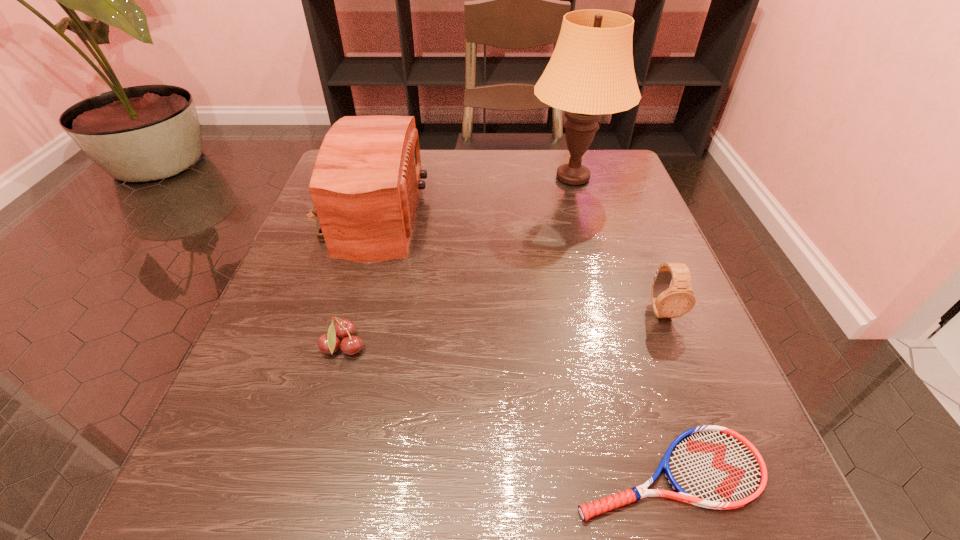
Find the location of a particular element. tennis racket that is at the right edge is located at coordinates (714, 467).

This screenshot has width=960, height=540. I want to click on object located at the far left corner, so tap(365, 183).

At what (x,y) coordinates should I click in order to perform the action: click on object that is at the far right corner. Please return your answer as a coordinate pair (x, y). This screenshot has height=540, width=960. Looking at the image, I should click on (591, 72).

This screenshot has width=960, height=540. I want to click on object that is positioned at the near right corner, so click(x=714, y=467).

Locate an element on the screen. Image resolution: width=960 pixels, height=540 pixels. vacant space at the far edge of the desktop is located at coordinates (561, 200).

Where is `free space at the near edge of the desktop`? free space at the near edge of the desktop is located at coordinates (427, 465).

In the image, there is a desktop. Where is `vacant space at the left edge`? This screenshot has height=540, width=960. vacant space at the left edge is located at coordinates point(324,295).

Find the location of a particular element. This screenshot has height=540, width=960. vacant space at the right edge of the desktop is located at coordinates (580, 240).

This screenshot has width=960, height=540. Find the location of `free space at the near left corner`. free space at the near left corner is located at coordinates (256, 470).

At what (x,y) coordinates should I click in order to perform the action: click on free region at the near right corner of the desktop. Please return your answer as a coordinate pair (x, y). The image size is (960, 540). Looking at the image, I should click on (677, 529).